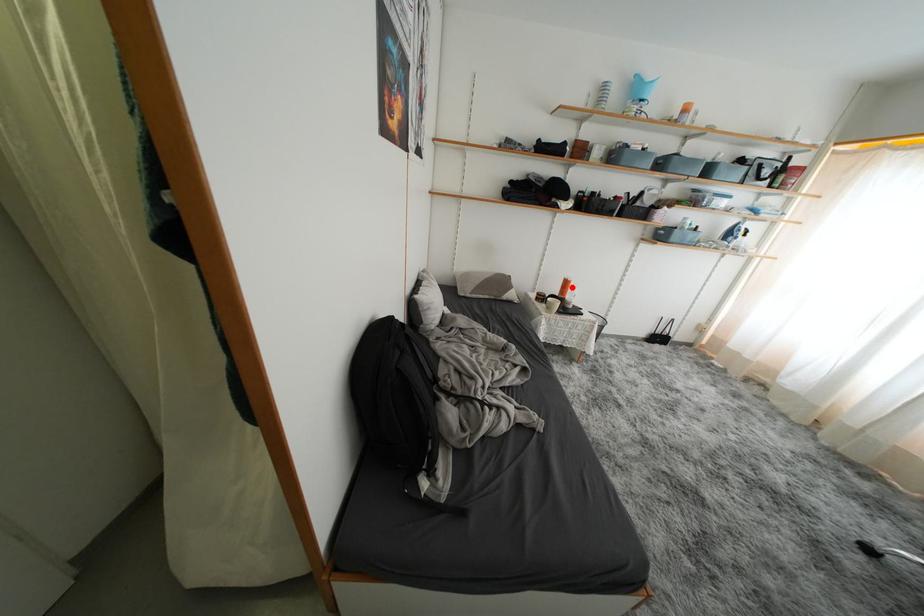
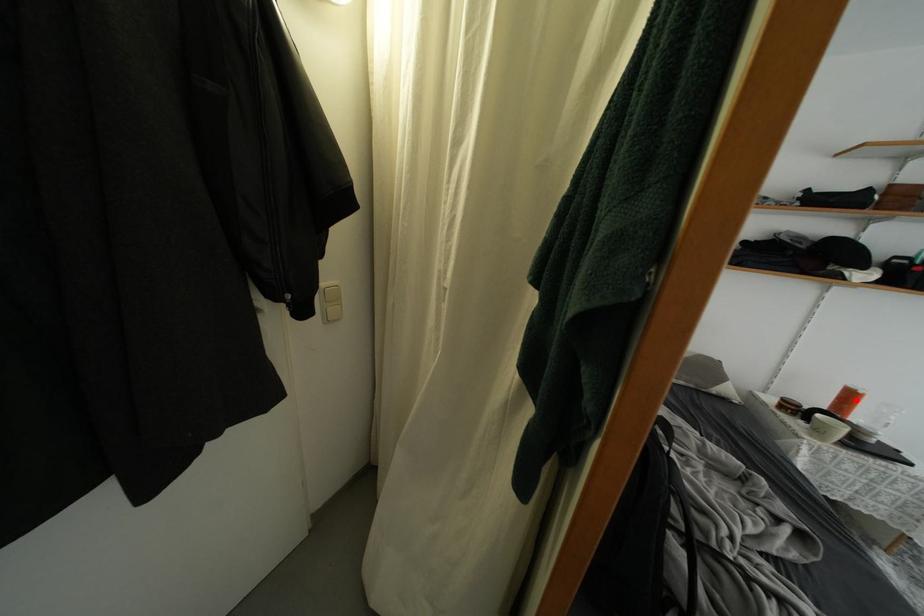
I am providing you with two images of the same scene from different viewpoints. A red point is marked on the first image and another point is marked on the second image. Is the marked point in image1 the same physical position as the marked point in image2?

Yes